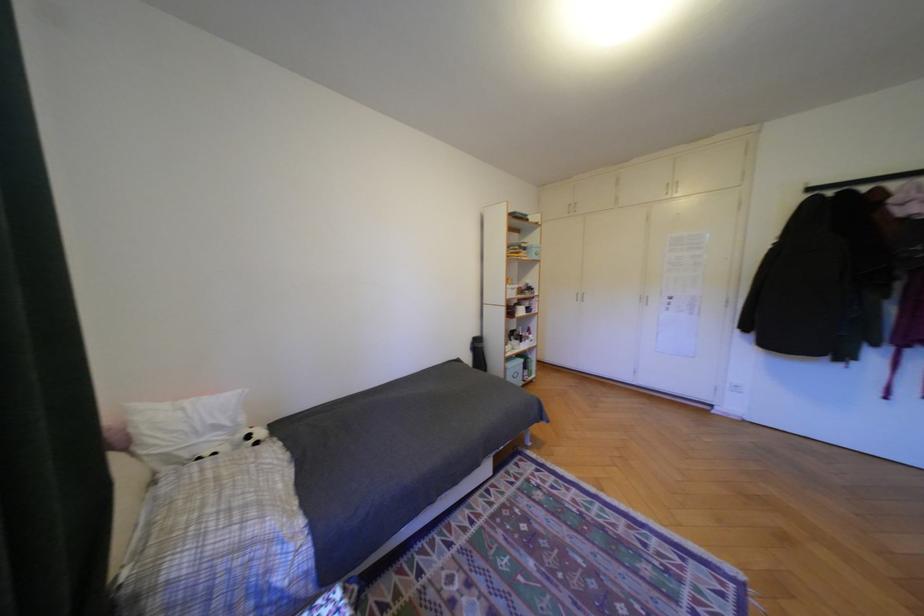
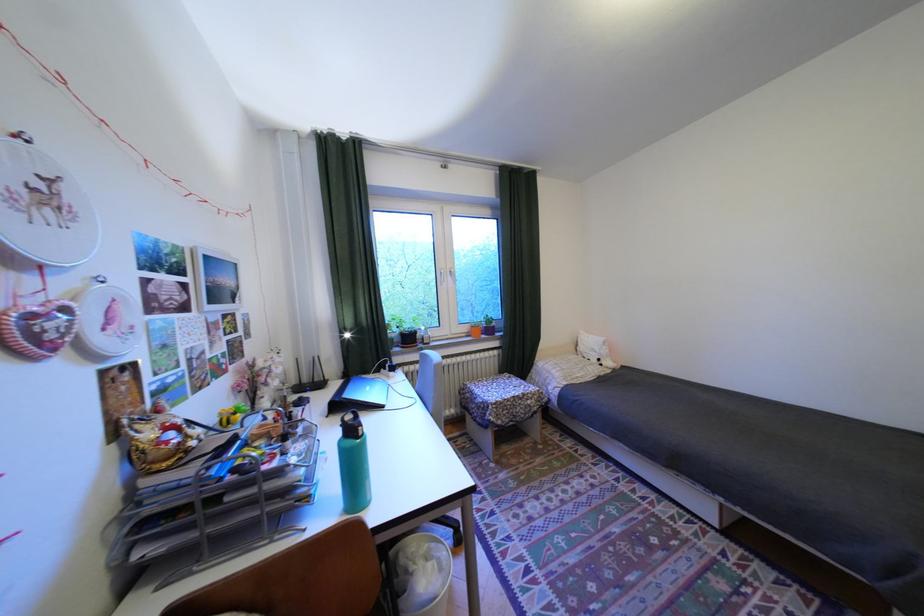
The point at (261,437) is marked in the first image. Where is the corresponding point in the second image?

(611, 360)